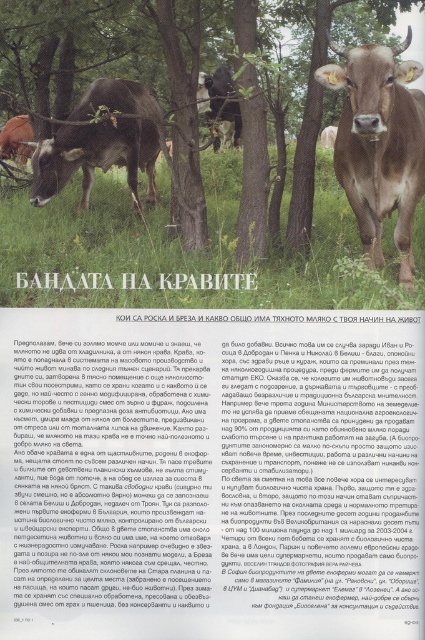
Can you confirm if whitetextured papersign at center is thinner than black glossy bull at center?

Incorrect, whitetextured papersign at center's width is not less than black glossy bull at center's.

Can you confirm if whitetextured papersign at center is shorter than black glossy bull at center?

Yes.

Is point (255, 275) closer to camera compared to point (210, 112)?

That is True.

The width and height of the screenshot is (425, 640). In order to click on whitetextured papersign at center in this screenshot , I will do `click(136, 280)`.

From the picture: Measure the distance between whitetextured papersign at center and camera.

whitetextured papersign at center and camera are 2.67 meters apart from each other.

Does whitetextured papersign at center lie in front of brown leather bull at upper left?

Yes.

Find the location of a particular element. Image resolution: width=425 pixels, height=640 pixels. whitetextured papersign at center is located at coordinates (136, 280).

Between brown glossy bull at center and black glossy bull at center, which one appears on the left side from the viewer's perspective?

From the viewer's perspective, black glossy bull at center appears more on the left side.

Locate an element on the screen. The image size is (425, 640). brown glossy bull at center is located at coordinates (379, 144).

The image size is (425, 640). What are the coordinates of `brown glossy bull at center` in the screenshot? It's located at (379, 144).